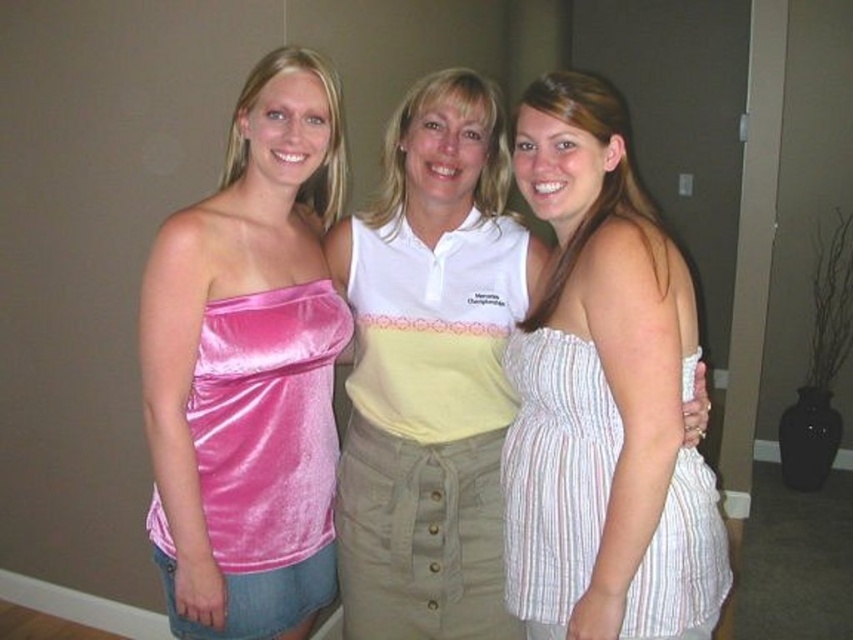
You are a photographer setting up for a group photo. You need to position two subjects so that the pink velvet top at left is on the left side of the white striped dress at right. Based on the scene description, does the current arrangement of the women already satisfy this requirement?

Yes, the current arrangement already satisfies the requirement because the pink velvet top at left is positioned to the left of the white striped dress at right.

You are organizing a clothing donation drive and need to sort items by size. You have two items to compare from the image provided. Which of the two items, the pink velvet top at left or the white cotton shirt at center, should be placed in the large size bin?

The pink velvet top at left is bigger than the white cotton shirt at center, so it should be placed in the large size bin.

You are trying to find the pink velvet top at left in the image. Based on the coordinates provided, where exactly is it positioned?

The pink velvet top at left is located at point 0.577 along the x axis and 0.293 along the y axis.